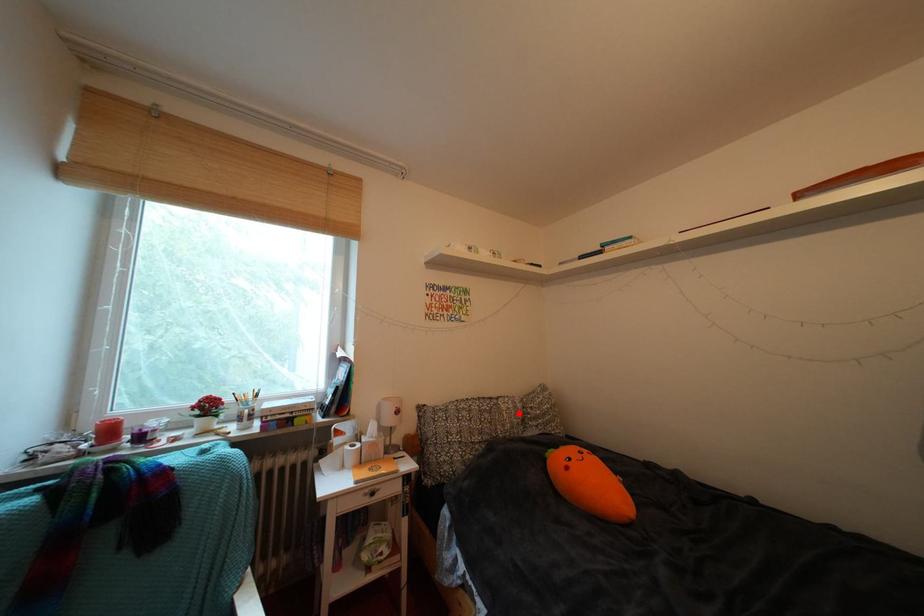
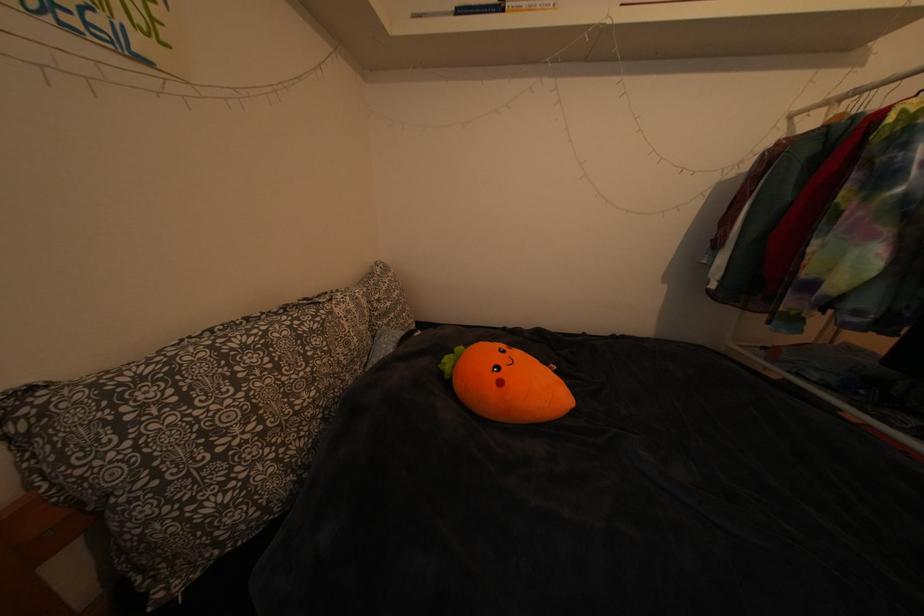
Question: I am providing you with two images of the same scene from different viewpoints. A red point is shown in image1. For the corresponding object point in image2, is it positioned nearer or farther from the camera?

Choices:
 (A) Nearer
 (B) Farther

Answer: (A)